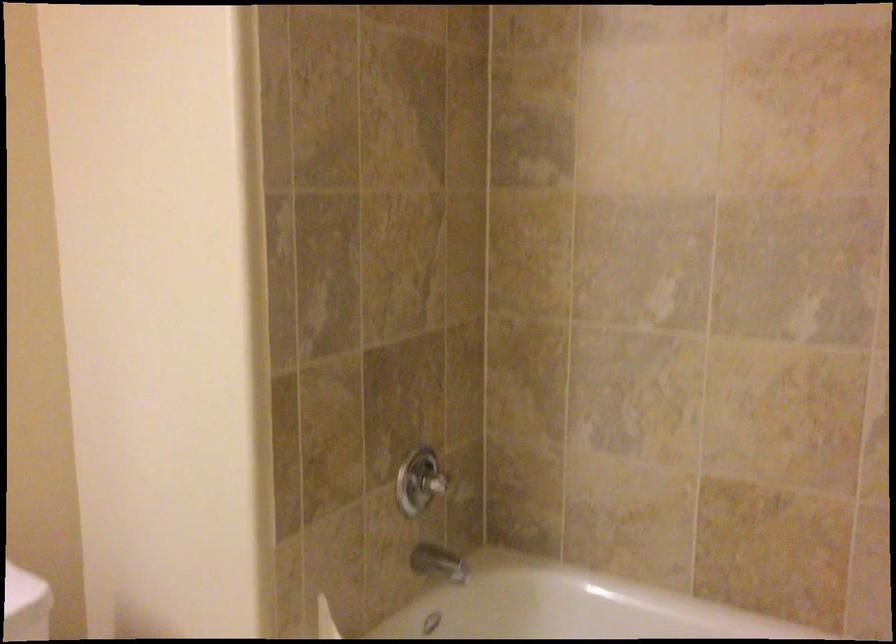
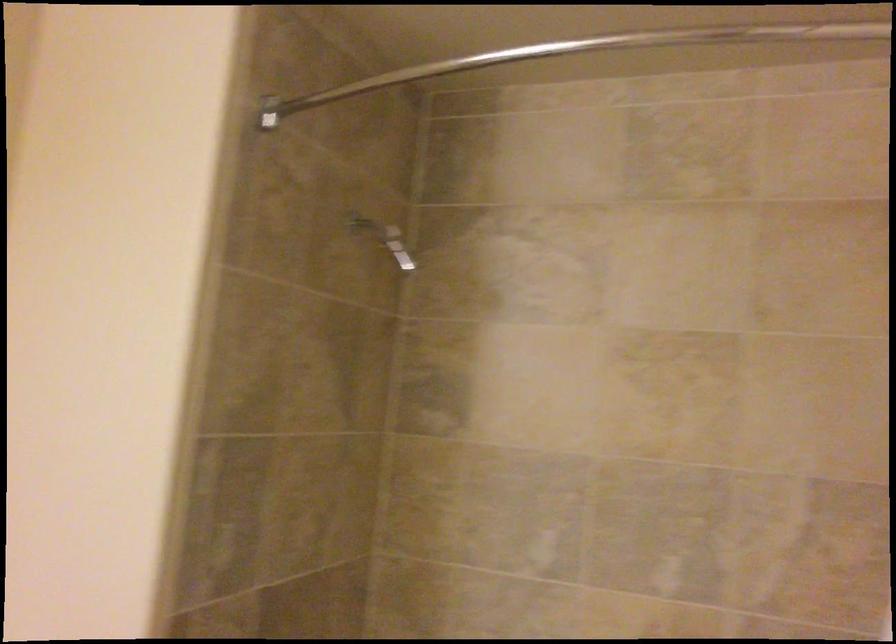
Question: How did the camera likely rotate?

Choices:
 (A) Left
 (B) Right
 (C) Up
 (D) Down

Answer: (C)